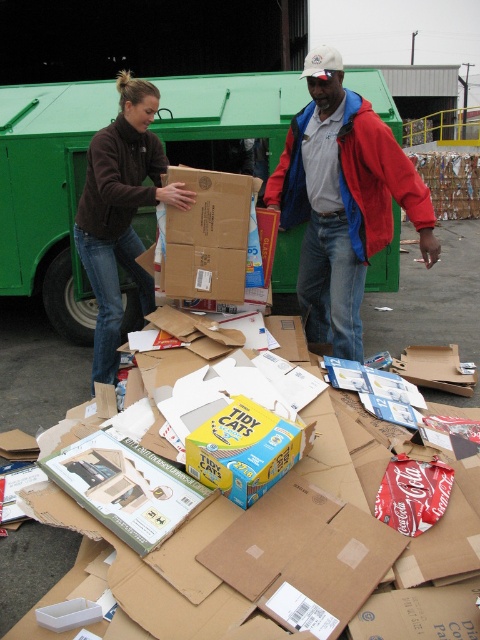
Question: Does dark brown fleece at center lie behind matte brown cardboard box at center?

Choices:
 (A) no
 (B) yes

Answer: (B)

Question: Where is green cardboard garbage truck at upper left located in relation to red jacket at center in the image?

Choices:
 (A) right
 (B) left

Answer: (B)

Question: Which object appears closest to the camera in this image?

Choices:
 (A) dark brown fleece at center
 (B) matte brown cardboard box at center
 (C) green cardboard garbage truck at upper left
 (D) red jacket at center

Answer: (D)

Question: Is red jacket at center wider than matte brown cardboard box at center?

Choices:
 (A) no
 (B) yes

Answer: (B)

Question: Considering the real-world distances, which object is farthest from the green cardboard garbage truck at upper left?

Choices:
 (A) matte brown cardboard box at center
 (B) red jacket at center

Answer: (B)

Question: Which point appears closest to the camera in this image?

Choices:
 (A) (116, 364)
 (B) (194, 122)
 (C) (170, 224)

Answer: (C)